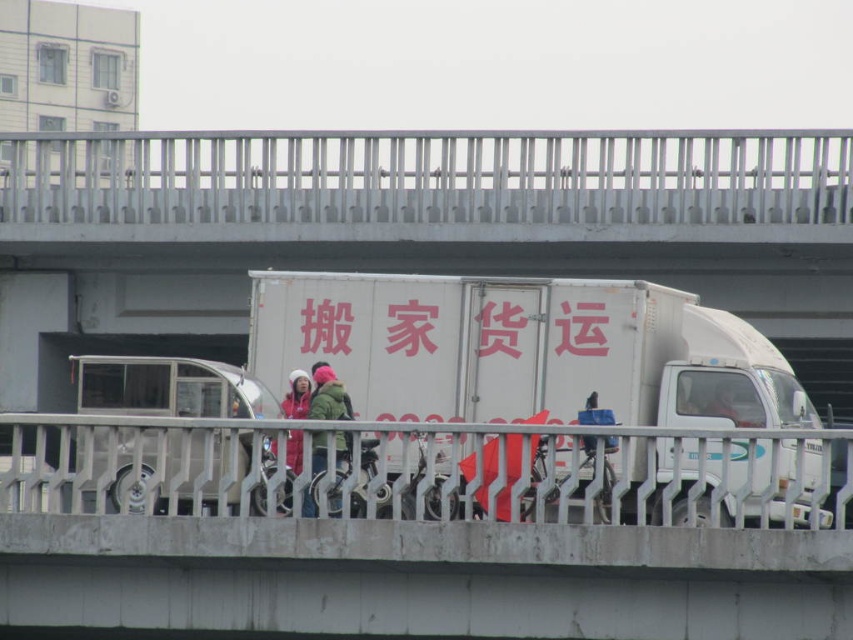
Question: Which object is positioned closest to the white matte truck at center?

Choices:
 (A) white metal railing at upper center
 (B) green fuzzy jacket at center
 (C) pink matte sign at center

Answer: (C)

Question: Does white matte truck at center have a greater width compared to green fuzzy jacket at center?

Choices:
 (A) yes
 (B) no

Answer: (A)

Question: Which point is closer to the camera taking this photo?

Choices:
 (A) (579, 477)
 (B) (74, 132)

Answer: (A)

Question: Which object is closer to the camera taking this photo?

Choices:
 (A) white metal railing at upper center
 (B) white matte truck at center

Answer: (B)

Question: From the image, what is the correct spatial relationship of white metal railing at upper center in relation to green fuzzy jacket at center?

Choices:
 (A) right
 (B) left

Answer: (B)

Question: Can you confirm if white metal railing at upper center is smaller than red matte jacket at center?

Choices:
 (A) no
 (B) yes

Answer: (A)